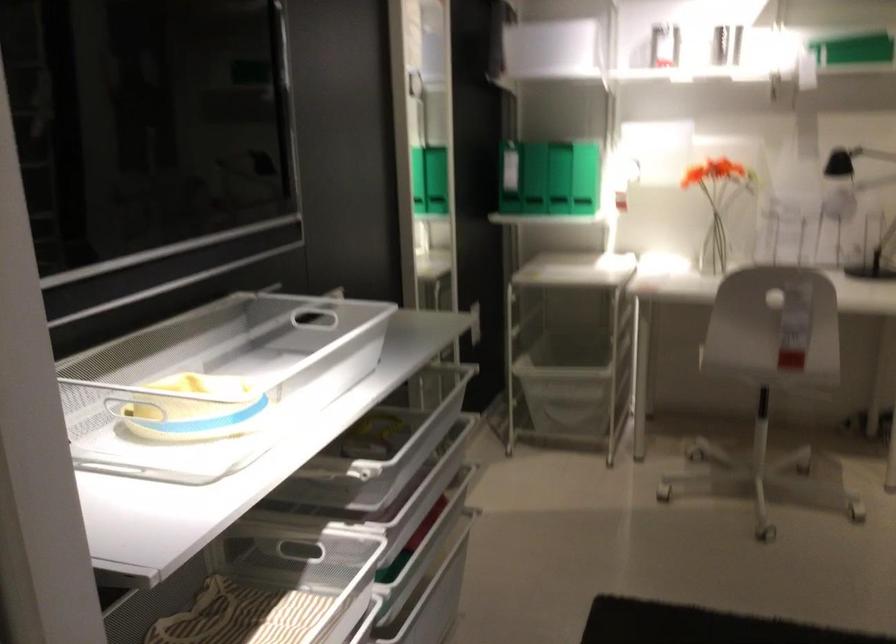
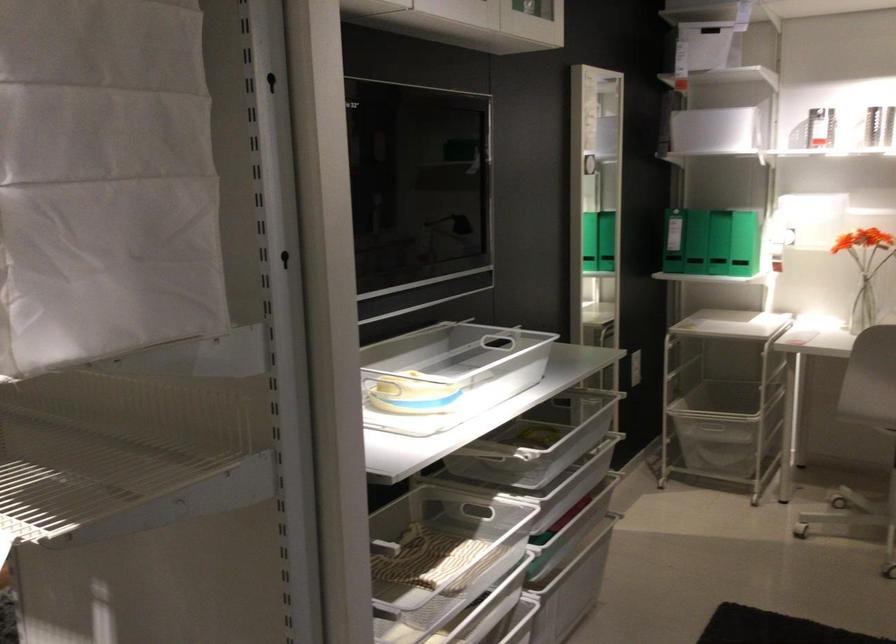
Where in the second image is the point corresponding to pixel 494 185 from the first image?

(673, 241)